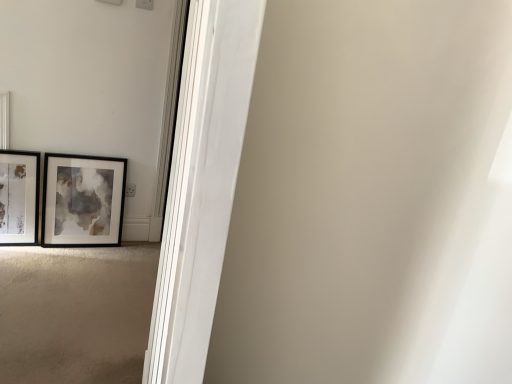
What do you see at coordinates (83, 200) in the screenshot?
I see `matte black frame at left` at bounding box center [83, 200].

Locate an element on the screen. The image size is (512, 384). matte black frame at left is located at coordinates (83, 200).

Where is `matte black frame at left`? The width and height of the screenshot is (512, 384). matte black frame at left is located at coordinates (83, 200).